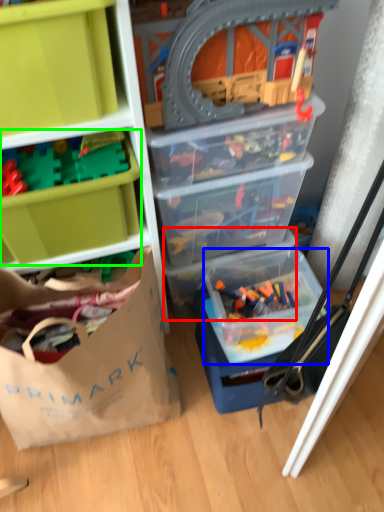
Question: Based on their relative distances, which object is farther from storage box (highlighted by a red box)? Choose from storage box (highlighted by a blue box) and storage box (highlighted by a green box).

Choices:
 (A) storage box
 (B) storage box

Answer: (B)